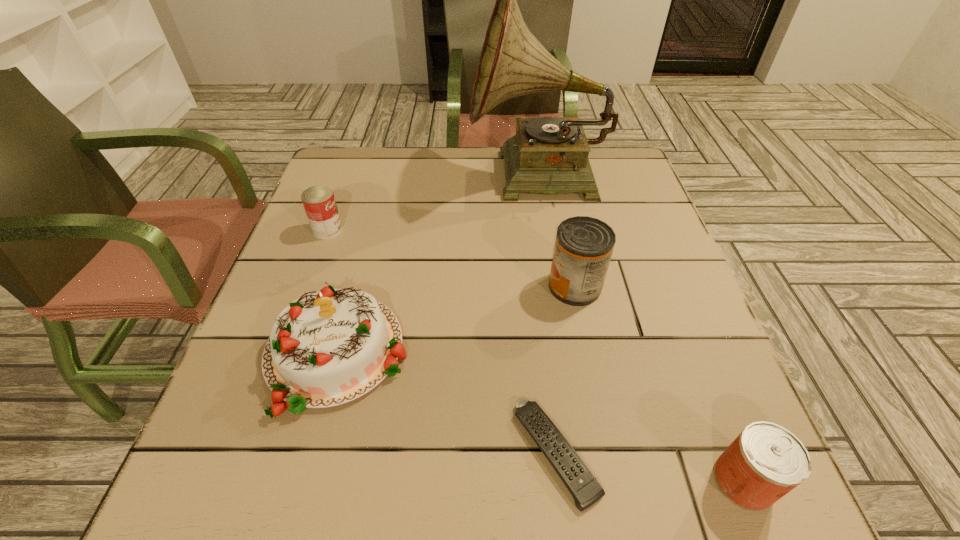
At what (x,y) coordinates should I click in order to perform the action: click on vacant point located between the rightmost can and the record player. Please return your answer as a coordinate pair (x, y). Looking at the image, I should click on (640, 329).

The image size is (960, 540). I want to click on free spot between the rightmost can and the tallest object, so click(640, 329).

At what (x,y) coordinates should I click in order to perform the action: click on free area in between the second can from left to right and the tallest object. Please return your answer as a coordinate pair (x, y). Looking at the image, I should click on (556, 232).

The width and height of the screenshot is (960, 540). I want to click on free point between the tallest object and the fifth nearest object, so click(x=433, y=204).

Locate an element on the screen. This screenshot has height=540, width=960. object that can be found as the closest to the shortest object is located at coordinates (766, 461).

Locate which object is the closest to the rightmost object. Please provide its 2D coordinates. Your answer should be formatted as a tuple, i.e. [(x, y)], where the tuple contains the x and y coordinates of a point satisfying the conditions above.

[(585, 489)]

Identify which can is the nearest to the second farthest can. Please provide its 2D coordinates. Your answer should be formatted as a tuple, i.e. [(x, y)], where the tuple contains the x and y coordinates of a point satisfying the conditions above.

[(766, 461)]

Locate which can is the second closest to the cake. Please provide its 2D coordinates. Your answer should be formatted as a tuple, i.e. [(x, y)], where the tuple contains the x and y coordinates of a point satisfying the conditions above.

[(584, 245)]

Locate an element on the screen. vacant space that satisfies the following two spatial constraints: 1. on the front label of the leftmost can; 2. on the back side of the rightmost can is located at coordinates (235, 481).

Where is `free space that satisfies the following two spatial constraints: 1. from the horn of the farthest object; 2. on the back side of the nearest can`? The image size is (960, 540). free space that satisfies the following two spatial constraints: 1. from the horn of the farthest object; 2. on the back side of the nearest can is located at coordinates (587, 481).